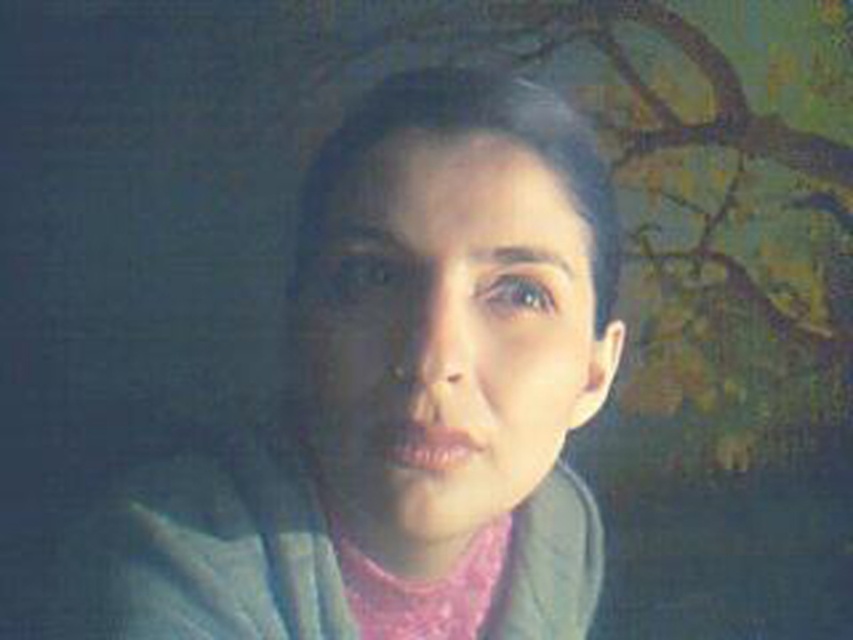
Question: Among these objects, which one is farthest from the camera?

Choices:
 (A) pink satin scarf at center
 (B) matte blue jacket at center

Answer: (A)

Question: Observing the image, what is the correct spatial positioning of matte blue jacket at center in reference to pink satin scarf at center?

Choices:
 (A) below
 (B) above

Answer: (B)

Question: Can you confirm if matte blue jacket at center is positioned below pink satin scarf at center?

Choices:
 (A) yes
 (B) no

Answer: (B)

Question: Does matte blue jacket at center appear over pink satin scarf at center?

Choices:
 (A) no
 (B) yes

Answer: (B)

Question: Which point is closer to the camera taking this photo?

Choices:
 (A) (386, 627)
 (B) (163, 468)

Answer: (B)

Question: Which of the following is the closest to the observer?

Choices:
 (A) (498, 518)
 (B) (515, 374)

Answer: (B)